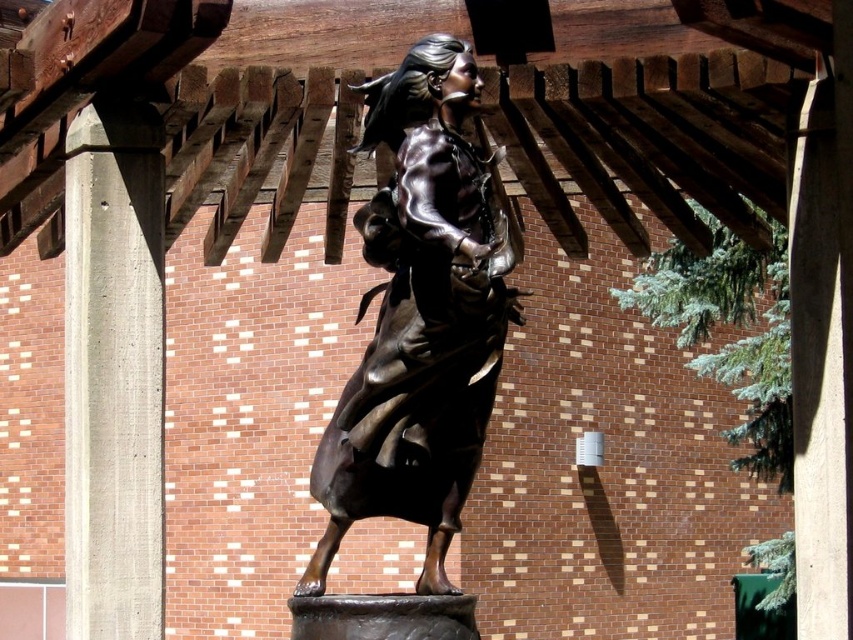
You are standing in front of the bronze statue under the wooden pergola. There are two points marked on the statue, one at coordinates point (373, 104) and another at point (160, 483). If you were to touch both points with your finger, which point would require you to reach further forward towards the statue?

Point (160, 483) would require you to reach further forward because it is closer to the camera than point (373, 104), meaning it is physically closer to your position.

You are a photographer standing at the camera position. You want to take a closeup shot of the shiny bronze statue at center. The statue is currently 122.84 feet away from you. You have a camera with a 100mm lens. Can you get a closeup shot of the statue without moving closer?

The shiny bronze statue at center is 122.84 feet away from the camera. With a 100mm lens, it is possible to capture a closeup shot of the statue without moving closer, as the lens allows for sufficient magnification at that distance.